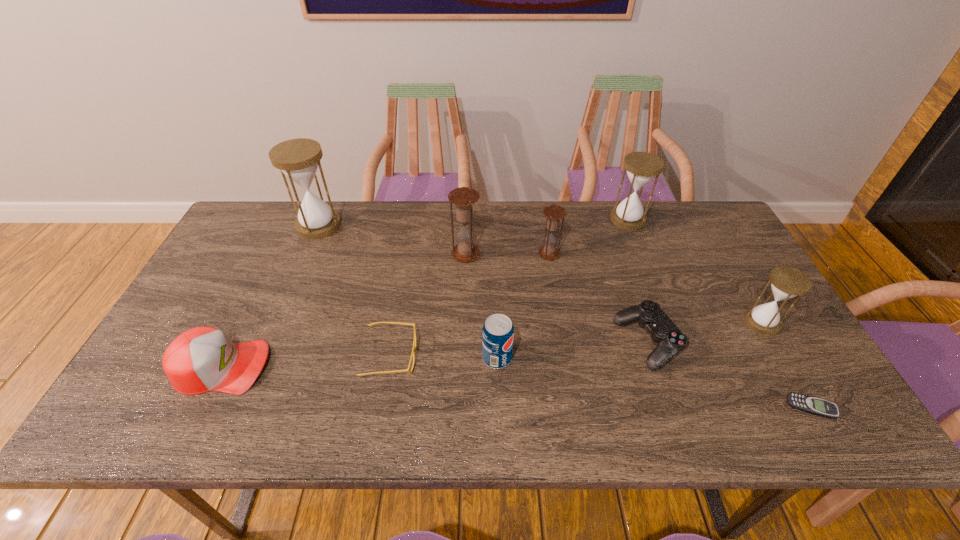
The height and width of the screenshot is (540, 960). In order to click on free space that is in between the third shortest object and the third hourglass from right to left in this screenshot , I will do `click(598, 299)`.

Find the location of a particular element. free space between the tallest hourglass and the bigger brown hourglass is located at coordinates (392, 240).

What are the coordinates of `free space between the ninth tallest object and the baseball cap` in the screenshot? It's located at (306, 361).

Locate an element on the screen. The height and width of the screenshot is (540, 960). vacant area that lies between the left brown hourglass and the beeper is located at coordinates (638, 330).

In order to click on free space that is in between the second white hourglass from right to left and the biggest white hourglass in this screenshot , I will do point(473,222).

At what (x,y) coordinates should I click in order to perform the action: click on vacant point located between the blue pop and the eighth object from right to left. Please return your answer as a coordinate pair (x, y). This screenshot has height=540, width=960. Looking at the image, I should click on (444, 357).

The width and height of the screenshot is (960, 540). Identify the location of vacant space that is in between the smallest white hourglass and the leftmost white hourglass. (540, 274).

Identify the location of free space between the eighth tallest object and the rightmost hourglass. coord(705,333).

At what (x,y) coordinates should I click in order to perform the action: click on unoccupied position between the third hourglass from left to right and the second biggest white hourglass. Please return your answer as a coordinate pair (x, y). This screenshot has width=960, height=540. Looking at the image, I should click on (588, 237).

This screenshot has height=540, width=960. I want to click on object that is the fifth closest to the leftmost hourglass, so click(554, 213).